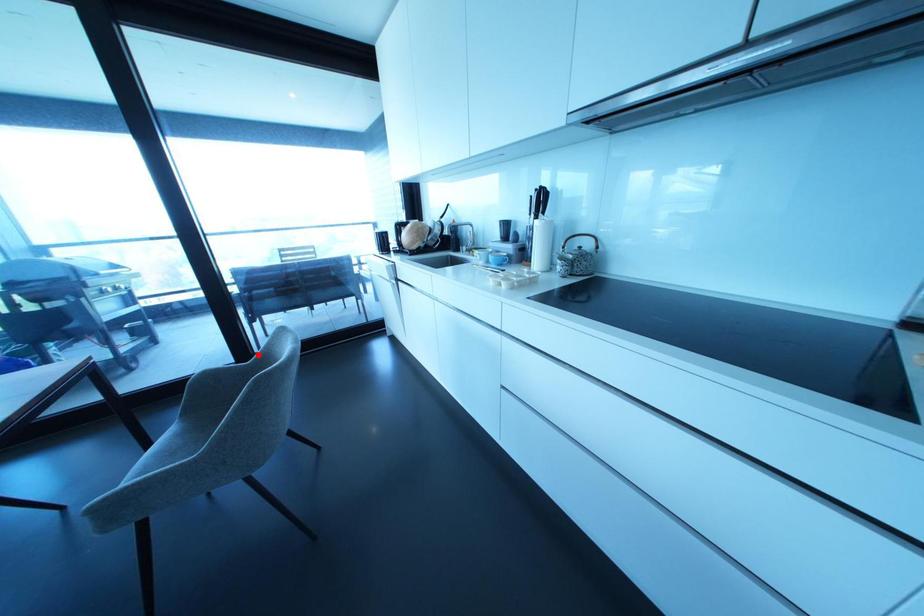
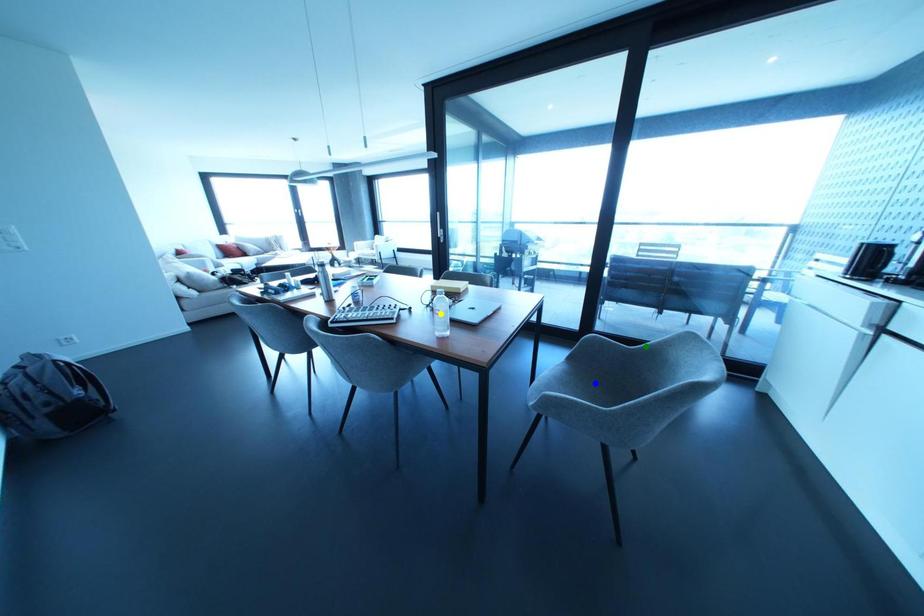
Question: I am providing you with two images of the same scene from different viewpoints. A red point is marked on the first image. You are given multiple points on the second image. Which mark in image 2 goes with the point in image 1?

Choices:
 (A) blue point
 (B) green point
 (C) yellow point

Answer: (B)